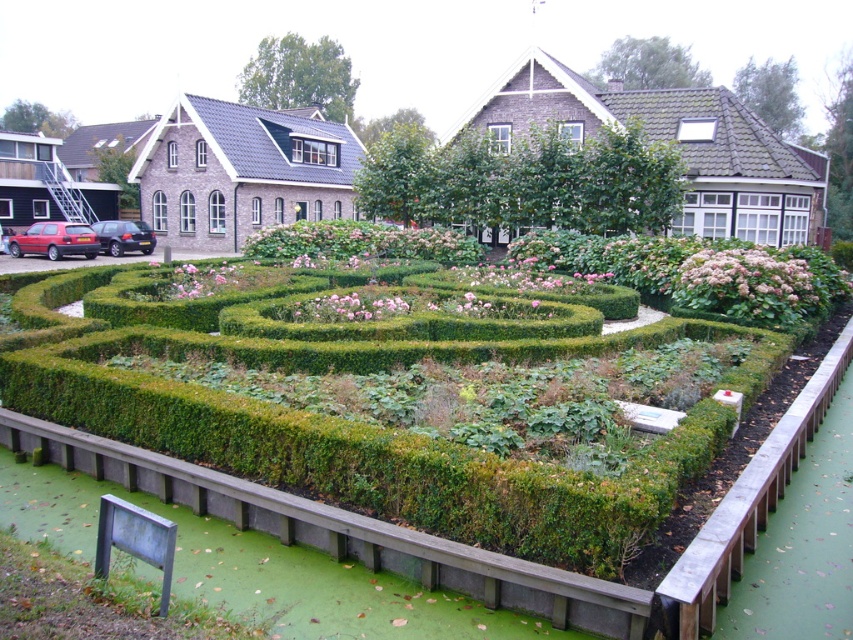
You are standing at the entrance of the hedge maze and see two points marked in the garden. The first point is at coordinate point (213, 396) and the second is at point (503, 172). Which point is closer to you as you face the maze entrance?

Point (213, 396) is in front of point (503, 172), so it is closer to you as you face the maze entrance.

You are a gardener planning to plant a row of sunflowers between the green hedge maze at center and the green leafy hedge at center. Given that each sunflower requires 30 cm of space, can you determine if there is enough space between them to accommodate the sunflowers?

The green hedge maze at center is narrower than the green leafy hedge at center. However, the exact distance between them isn not specified in the description. Therefore, it is unclear if there is sufficient space to plant the sunflowers.

You are standing at the edge of the garden and want to take a photo of the green hedge maze at center. Your camera has a maximum zoom range of 4 meters. Can you capture the entire maze without moving closer?

The green hedge maze at center and camera are 5.31 meters apart from each other. Since the camera can only zoom up to 4 meters, you cannot capture the entire maze without moving closer.